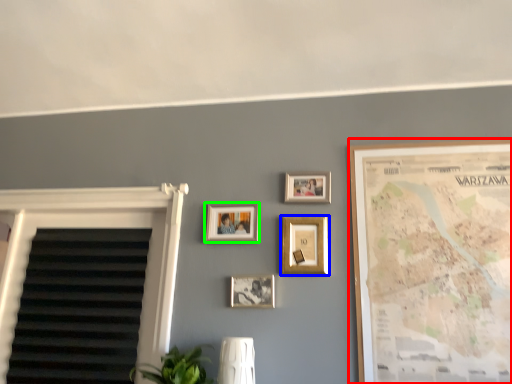
Question: Which object is positioned closest to picture frame (highlighted by a red box)? Select from picture frame (highlighted by a blue box) and picture frame (highlighted by a green box).

Choices:
 (A) picture frame
 (B) picture frame

Answer: (A)